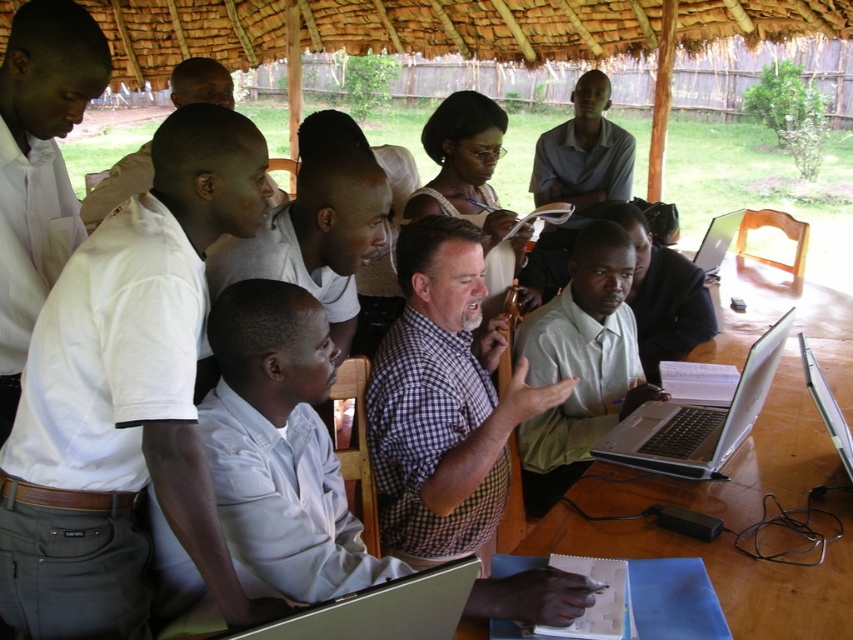
Can you confirm if light green shirt at center is positioned above white shirt at upper left?

No, light green shirt at center is not above white shirt at upper left.

Can you confirm if light green shirt at center is wider than white shirt at upper left?

Yes, light green shirt at center is wider than white shirt at upper left.

Where is `light green shirt at center`? This screenshot has width=853, height=640. light green shirt at center is located at coordinates (662, 296).

Is point (99, 220) behind point (816, 404)?

Yes, point (99, 220) is farther from viewer.

Does white shirt at upper left lie behind silver metallic laptop at lower right?

Yes.

Who is more forward, [215,64] or [850,468]?

Point [850,468] is in front.

In order to click on white shirt at upper left in this screenshot , I will do `click(117, 186)`.

Does white cotton shirt at left have a greater width compared to silver metallic laptop at lower right?

Correct, the width of white cotton shirt at left exceeds that of silver metallic laptop at lower right.

Does white cotton shirt at left appear over silver metallic laptop at lower right?

Yes.

Does point (53, 340) come closer to viewer compared to point (846, 468)?

Yes, point (53, 340) is in front of point (846, 468).

Identify the location of white cotton shirt at left. This screenshot has height=640, width=853. (144, 342).